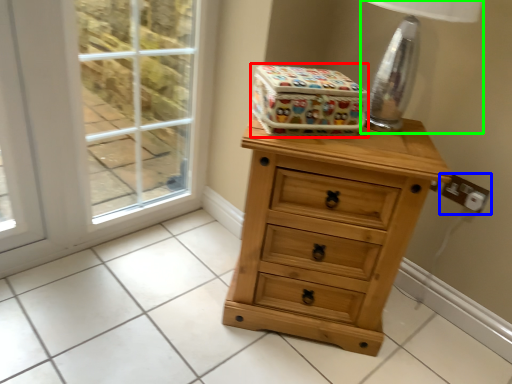
Question: Which object is positioned farthest from storage box (highlighted by a red box)? Select from electric outlet (highlighted by a blue box) and table lamp (highlighted by a green box).

Choices:
 (A) electric outlet
 (B) table lamp

Answer: (A)